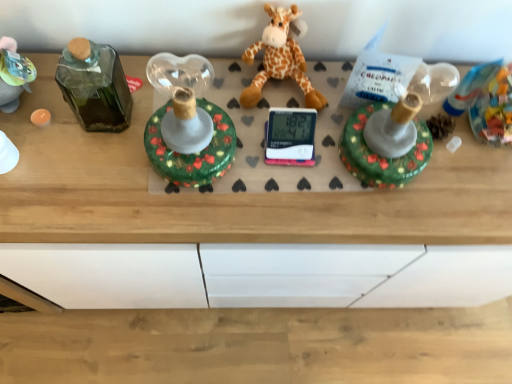
Find the location of a particular element. The width and height of the screenshot is (512, 384). blank area to the left of shiny green glass candlestick at center is located at coordinates (101, 162).